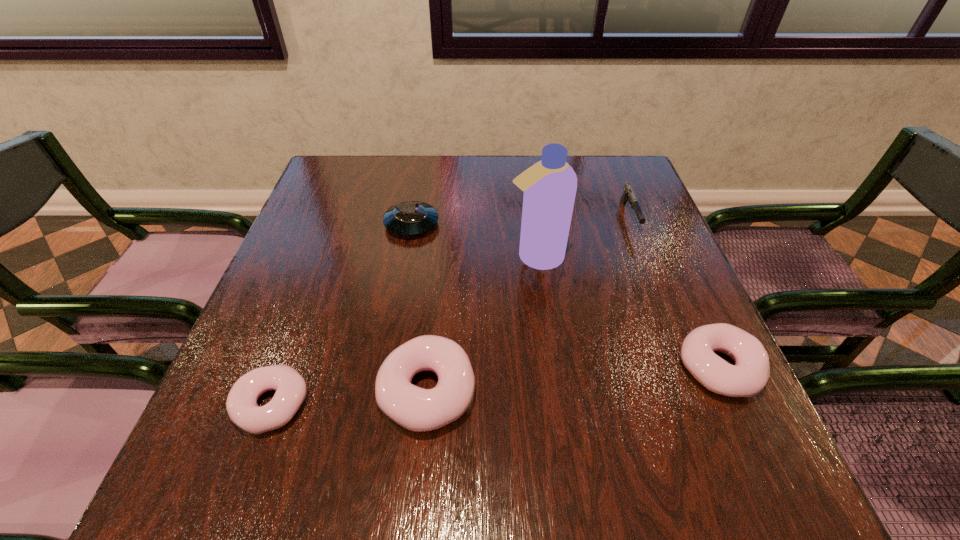
To make them evenly spaced by inserting another doughnut among them, please locate a vacant spot for this new doughnut. Please provide its 2D coordinates. Your answer should be formatted as a tuple, i.e. [(x, y)], where the tuple contains the x and y coordinates of a point satisfying the conditions above.

[(576, 380)]